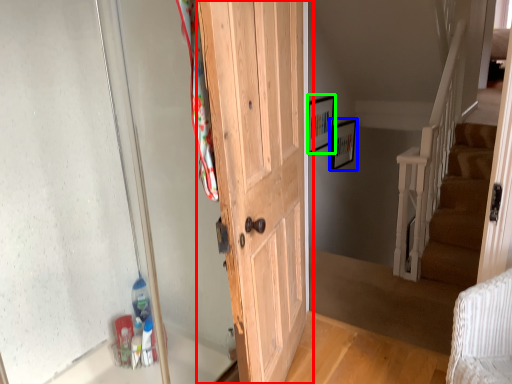
Question: Which object is the closest to the door (highlighted by a red box)? Choose among these: picture frame (highlighted by a blue box) or picture frame (highlighted by a green box).

Choices:
 (A) picture frame
 (B) picture frame

Answer: (B)